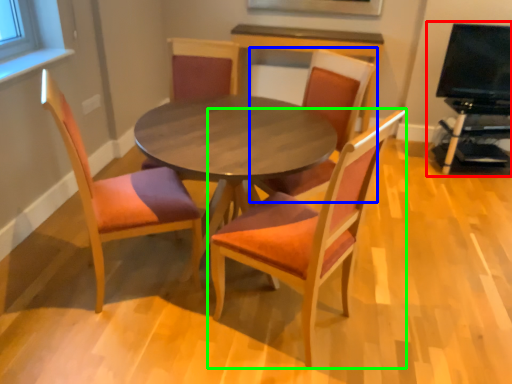
Question: Considering the real-world distances, which object is farthest from entertainment center (highlighted by a red box)? chair (highlighted by a blue box) or chair (highlighted by a green box)?

Choices:
 (A) chair
 (B) chair

Answer: (B)